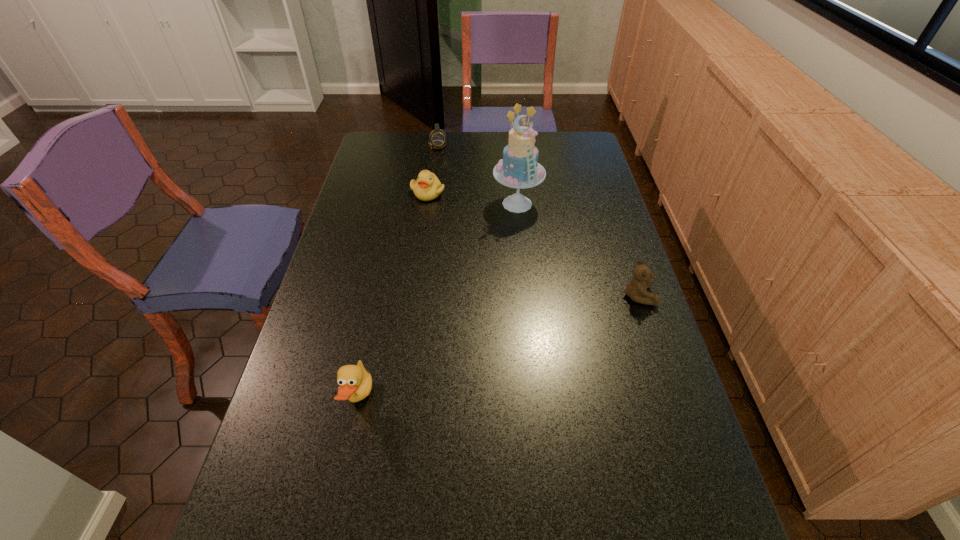
You are a GUI agent. You are given a task and a screenshot of the screen. Output one action in this format:
    pyautogui.click(x=<x>, y=<y>)
    Task: Click on the duck
    Image resolution: width=960 pixels, height=540 pixels.
    Given the screenshot: What is the action you would take?
    pyautogui.click(x=355, y=382)

The image size is (960, 540). I want to click on the nearest object, so click(355, 382).

Image resolution: width=960 pixels, height=540 pixels. Identify the location of teddy bear. (636, 289).

Locate an element on the screen. The image size is (960, 540). the rightmost object is located at coordinates (636, 289).

Locate an element on the screen. The width and height of the screenshot is (960, 540). the tallest object is located at coordinates (519, 168).

You are a GUI agent. You are given a task and a screenshot of the screen. Output one action in this format:
    pyautogui.click(x=<x>, y=<y>)
    Task: Click on the fourth object from left to right
    
    Given the screenshot: What is the action you would take?
    pyautogui.click(x=519, y=168)

Image resolution: width=960 pixels, height=540 pixels. What are the coordinates of `the farthest object` in the screenshot? It's located at (437, 138).

Where is `duckling`? The height and width of the screenshot is (540, 960). duckling is located at coordinates (427, 187).

I want to click on free spot located 0.070m on the beak of the nearest object, so click(x=402, y=399).

The height and width of the screenshot is (540, 960). In order to click on blank area located with a ladder on the side of the second object from right to left in this screenshot , I will do `click(520, 258)`.